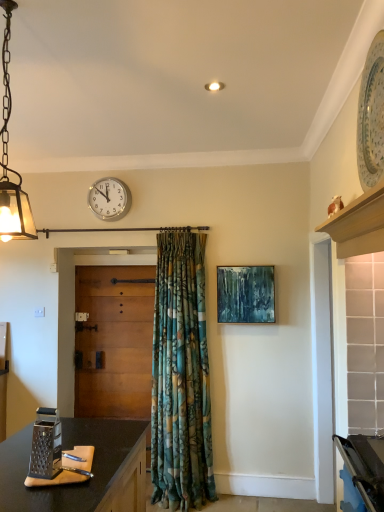
Measure the distance between metallic grater at lower left and camera.

A distance of 5.11 feet exists between metallic grater at lower left and camera.

Locate an element on the screen. This screenshot has height=512, width=384. metallic grater at lower left is located at coordinates (55, 454).

Does metallic grater at lower left appear on the right side of white plastic wall clock at upper center?

Yes, metallic grater at lower left is to the right of white plastic wall clock at upper center.

Is metallic grater at lower left bigger than white plastic wall clock at upper center?

No, metallic grater at lower left is not bigger than white plastic wall clock at upper center.

Relative to white plastic wall clock at upper center, is metallic grater at lower left in front or behind?

In the image, metallic grater at lower left appears in front of white plastic wall clock at upper center.

Measure the distance from metallic grater at lower left to white plastic wall clock at upper center.

metallic grater at lower left is 6.47 feet away from white plastic wall clock at upper center.

From a real-world perspective, which is physically above, white plastic wall clock at upper center or teal textured canvas at center?

In real-world perspective, white plastic wall clock at upper center is above.

From the image's perspective, is white plastic wall clock at upper center above or below teal textured canvas at center?

Clearly, from the image's perspective, white plastic wall clock at upper center is above teal textured canvas at center.

Where is `picture frame on the right of white plastic wall clock at upper center`? Image resolution: width=384 pixels, height=512 pixels. picture frame on the right of white plastic wall clock at upper center is located at coordinates (245, 294).

Is white plastic wall clock at upper center facing towards teal textured canvas at center?

No, white plastic wall clock at upper center is not facing towards teal textured canvas at center.

Based on the photo, from the image's perspective, is matte glass pendant light at left located above white plastic wall clock at upper center?

Yes, from the image's perspective, matte glass pendant light at left is over white plastic wall clock at upper center.

Who is bigger, matte glass pendant light at left or white plastic wall clock at upper center?

matte glass pendant light at left is bigger.

Is matte glass pendant light at left wider than white plastic wall clock at upper center?

Correct, the width of matte glass pendant light at left exceeds that of white plastic wall clock at upper center.

There is a matte glass pendant light at left. What are the coordinates of `wall clock above it (from a real-world perspective)` in the screenshot? It's located at (109, 199).

Does teal textured canvas at center lie in front of white plastic wall clock at upper center?

Yes.

Can you confirm if teal textured canvas at center is wider than white plastic wall clock at upper center?

Yes, teal textured canvas at center is wider than white plastic wall clock at upper center.

Who is shorter, teal textured canvas at center or white plastic wall clock at upper center?

white plastic wall clock at upper center.

How much distance is there between teal textured canvas at center and matte glass pendant light at left?

teal textured canvas at center and matte glass pendant light at left are 6.30 feet apart from each other.

Considering the relative sizes of teal textured canvas at center and matte glass pendant light at left in the image provided, is teal textured canvas at center thinner than matte glass pendant light at left?

Yes, teal textured canvas at center is thinner than matte glass pendant light at left.

Looking at this image, is teal textured canvas at center not near matte glass pendant light at left?

That's right, there is a large distance between teal textured canvas at center and matte glass pendant light at left.

Between wooden door at center and matte glass pendant light at left, which one appears on the left side from the viewer's perspective?

wooden door at center.

From the image's perspective, between wooden door at center and matte glass pendant light at left, which one is located above?

From the image's view, matte glass pendant light at left is above.

How different are the orientations of wooden door at center and matte glass pendant light at left in degrees?

12.8 degrees.

What are the coordinates of `door below the matte glass pendant light at left (from the image's perspective)` in the screenshot? It's located at (114, 341).

This screenshot has height=512, width=384. What are the coordinates of `appliance in front of the teal textured canvas at center` in the screenshot? It's located at (55, 454).

From a real-world perspective, which object rests below the other?

metallic grater at lower left is physically lower.

Considering the relative sizes of metallic grater at lower left and teal textured canvas at center in the image provided, is metallic grater at lower left smaller than teal textured canvas at center?

Yes.

Based on the photo, considering the relative positions of metallic grater at lower left and teal textured canvas at center in the image provided, is metallic grater at lower left to the right of teal textured canvas at center from the viewer's perspective?

In fact, metallic grater at lower left is to the left of teal textured canvas at center.

Find the location of a particular element. This screenshot has height=512, width=384. wall clock that appears above the metallic grater at lower left (from the image's perspective) is located at coordinates (109, 199).

Where is `picture frame in front of the white plastic wall clock at upper center`? This screenshot has width=384, height=512. picture frame in front of the white plastic wall clock at upper center is located at coordinates (245, 294).

Considering their positions, is wooden door at center positioned closer to teal textured canvas at center than white plastic wall clock at upper center?

wooden door at center is closer to teal textured canvas at center.

Looking at the image, which one is located closer to teal textured canvas at center, matte glass pendant light at left or white plastic wall clock at upper center?

The object closer to teal textured canvas at center is white plastic wall clock at upper center.

From the image, which object appears to be farther from matte glass pendant light at left, teal textured canvas at center or white plastic wall clock at upper center?

teal textured canvas at center lies further to matte glass pendant light at left than the other object.

From the image, which object appears to be nearer to wooden door at center, matte glass pendant light at left or metallic grater at lower left?

metallic grater at lower left is closer to wooden door at center.

Based on their spatial positions, is white plastic wall clock at upper center or teal textured canvas at center closer to matte glass pendant light at left?

white plastic wall clock at upper center is closer to matte glass pendant light at left.

Based on their spatial positions, is matte glass pendant light at left or white plastic wall clock at upper center closer to metallic grater at lower left?

Based on the image, matte glass pendant light at left appears to be nearer to metallic grater at lower left.

Based on their spatial positions, is metallic grater at lower left or matte glass pendant light at left closer to teal textured canvas at center?

Based on the image, metallic grater at lower left appears to be nearer to teal textured canvas at center.

Looking at the image, which one is located further to metallic grater at lower left, white plastic wall clock at upper center or matte glass pendant light at left?

white plastic wall clock at upper center lies further to metallic grater at lower left than the other object.

Image resolution: width=384 pixels, height=512 pixels. I want to click on appliance between matte glass pendant light at left and teal textured canvas at center along the z-axis, so click(x=55, y=454).

This screenshot has height=512, width=384. I want to click on picture frame between metallic grater at lower left and white plastic wall clock at upper center from front to back, so click(245, 294).

Locate an element on the screen. appliance located between matte glass pendant light at left and wooden door at center in the depth direction is located at coordinates (55, 454).

Find the location of a particular element. picture frame between matte glass pendant light at left and wooden door at center along the z-axis is located at coordinates (245, 294).